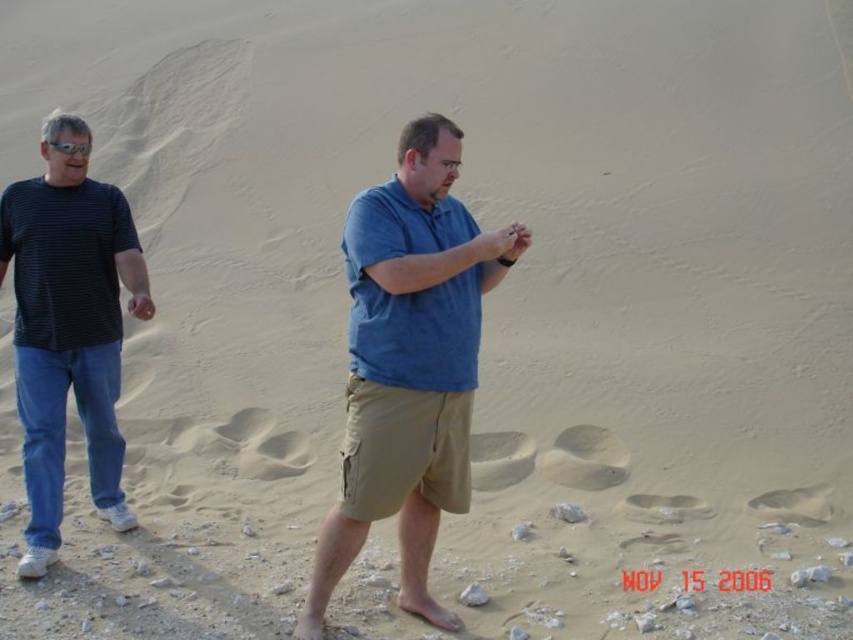
Is khaki shorts at center behind dark blue striped shirt at left?

That is False.

Who is more forward, (413, 140) or (38, 257)?

Point (413, 140) is more forward.

The width and height of the screenshot is (853, 640). Find the location of `khaki shorts at center`. khaki shorts at center is located at coordinates (409, 364).